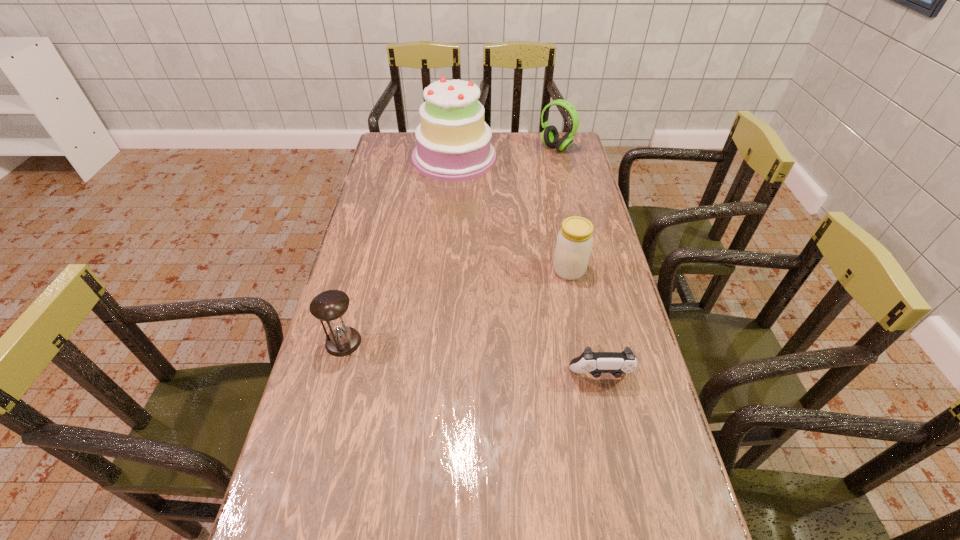
At what (x,y) coordinates should I click in order to perform the action: click on free spot located 0.060m on the back of the third nearest object. Please return your answer as a coordinate pair (x, y). Looking at the image, I should click on click(564, 246).

Identify the location of blank space located 0.310m on the back of the fourth farthest object. (368, 250).

Where is `vacant region located on the front-facing side of the nearest object`? vacant region located on the front-facing side of the nearest object is located at coordinates (616, 444).

At what (x,y) coordinates should I click in order to perform the action: click on cake that is at the far edge. Please return your answer as a coordinate pair (x, y). The height and width of the screenshot is (540, 960). Looking at the image, I should click on (453, 143).

You are a GUI agent. You are given a task and a screenshot of the screen. Output one action in this format:
    pyautogui.click(x=<x>, y=<y>)
    Task: Click on the headset located at the far edge
    The image size is (960, 540).
    Given the screenshot: What is the action you would take?
    pyautogui.click(x=550, y=136)

This screenshot has width=960, height=540. I want to click on cake that is at the left edge, so click(453, 143).

The height and width of the screenshot is (540, 960). In order to click on hourglass that is at the left edge in this screenshot , I will do `click(330, 306)`.

The height and width of the screenshot is (540, 960). In order to click on headset at the right edge in this screenshot , I will do `click(550, 136)`.

You are a GUI agent. You are given a task and a screenshot of the screen. Output one action in this format:
    pyautogui.click(x=<x>, y=<y>)
    Task: Click on the jar situated at the right edge
    The height and width of the screenshot is (540, 960).
    Given the screenshot: What is the action you would take?
    pyautogui.click(x=574, y=242)

Where is `control located at the right edge`? This screenshot has width=960, height=540. control located at the right edge is located at coordinates (595, 363).